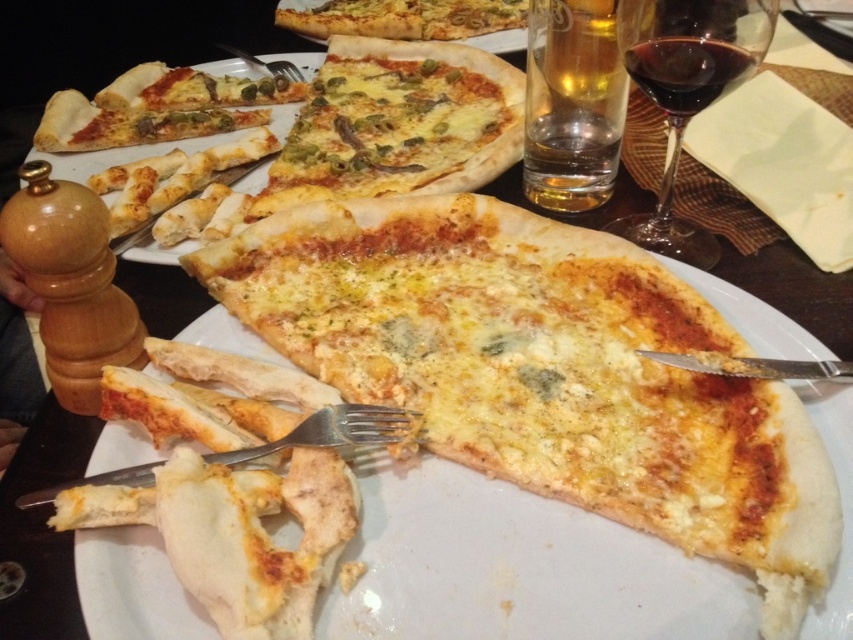
Who is more distant from viewer, (421,147) or (654,24)?

The point (421,147) is behind.

Does point (486, 99) come farther from viewer compared to point (706, 90)?

Yes, point (486, 99) is behind point (706, 90).

Identify the location of cheesy pizza at center. (398, 124).

Can you confirm if yellowish cheese pizza at center is shorter than translucent glass beer at upper right?

In fact, yellowish cheese pizza at center may be taller than translucent glass beer at upper right.

Does point (393, 352) come farther from viewer compared to point (541, 76)?

No, it is in front of (541, 76).

Which is in front, point (828, 547) or point (573, 179)?

Positioned in front is point (828, 547).

Identify the location of yellowish cheese pizza at center. Image resolution: width=853 pixels, height=640 pixels. (544, 371).

Is translucent glass beer at upper right behind cheesy pizza at upper center?

That is False.

What do you see at coordinates (572, 104) in the screenshot?
I see `translucent glass beer at upper right` at bounding box center [572, 104].

This screenshot has height=640, width=853. What are the coordinates of `translucent glass beer at upper right` in the screenshot? It's located at pyautogui.click(x=572, y=104).